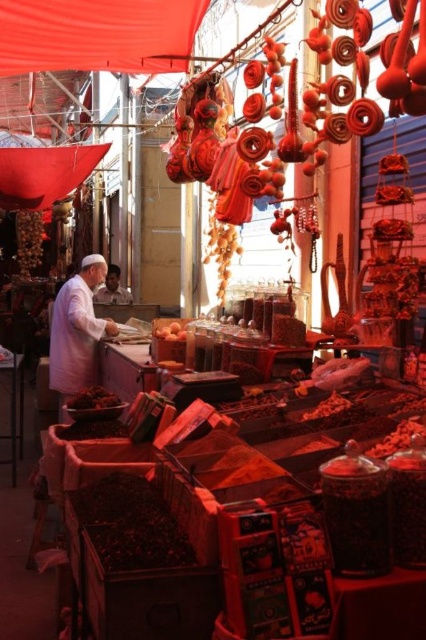
Who is positioned more to the right, dark brown matte dried fruit at lower left or brown matte dried fruit at center?

dark brown matte dried fruit at lower left is more to the right.

Does dark brown matte dried fruit at lower left have a greater height compared to brown matte dried fruit at center?

Indeed, dark brown matte dried fruit at lower left has a greater height compared to brown matte dried fruit at center.

Which is behind, point (77, 436) or point (86, 401)?

Positioned behind is point (86, 401).

Locate an element on the screen. The image size is (426, 640). dark brown matte dried fruit at lower left is located at coordinates (92, 429).

Who is positioned more to the left, white cotton shirt at left or dark brown matte dried fruit at lower left?

From the viewer's perspective, white cotton shirt at left appears more on the left side.

Is white cotton shirt at left wider than dark brown matte dried fruit at lower left?

Correct, the width of white cotton shirt at left exceeds that of dark brown matte dried fruit at lower left.

Is point (104, 317) positioned in front of point (106, 428)?

No, (104, 317) is further to viewer.

I want to click on white cotton shirt at left, so click(x=77, y=332).

Between brown matte dried fruit at center and white fabric man at left, which one has less height?

brown matte dried fruit at center is shorter.

Does point (101, 406) come behind point (103, 301)?

No, (101, 406) is in front of (103, 301).

Is point (71, 396) in front of point (112, 291)?

Yes, point (71, 396) is in front of point (112, 291).

This screenshot has height=640, width=426. Find the location of `brown matte dried fruit at center`. brown matte dried fruit at center is located at coordinates (92, 400).